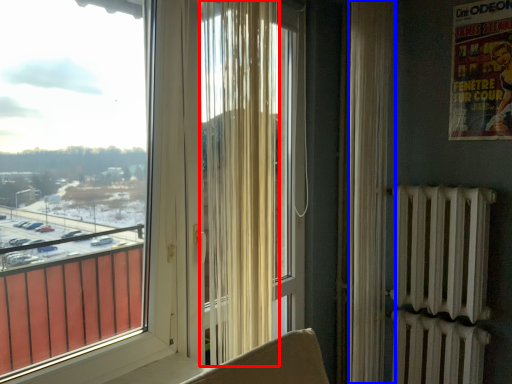
Question: Which of the following is the closest to the observer, curtain (highlighted by a red box) or curtain (highlighted by a blue box)?

Choices:
 (A) curtain
 (B) curtain

Answer: (A)